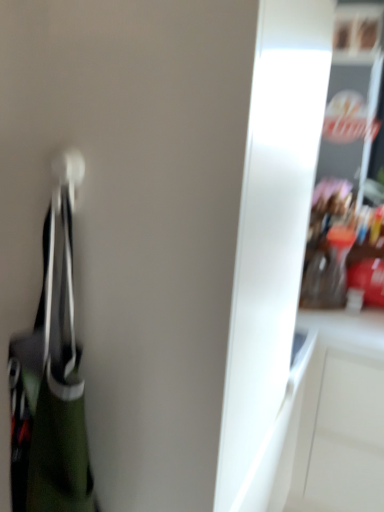
What do you see at coordinates (50, 394) in the screenshot?
I see `green fabric handbag at left` at bounding box center [50, 394].

Measure the distance between green fabric handbag at left and camera.

green fabric handbag at left is 65.99 centimeters from camera.

Locate an element on the screen. The image size is (384, 512). green fabric handbag at left is located at coordinates (50, 394).

Locate an element on the screen. The height and width of the screenshot is (512, 384). white glossy cabinet at right is located at coordinates (338, 418).

What do you see at coordinates (338, 418) in the screenshot? I see `white glossy cabinet at right` at bounding box center [338, 418].

Where is `green fabric handbag at left`? This screenshot has height=512, width=384. green fabric handbag at left is located at coordinates 50,394.

In the scene shown: Which is more to the left, white glossy cabinet at right or green fabric handbag at left?

green fabric handbag at left is more to the left.

Between white glossy cabinet at right and green fabric handbag at left, which one is positioned behind?

white glossy cabinet at right is further away from the camera.

Does point (381, 464) come farther from viewer compared to point (54, 341)?

Yes.

From the image's perspective, would you say white glossy cabinet at right is shown under green fabric handbag at left?

Correct, white glossy cabinet at right appears lower than green fabric handbag at left in the image.

From a real-world perspective, is white glossy cabinet at right beneath green fabric handbag at left?

Yes.

Which of these two, white glossy cabinet at right or green fabric handbag at left, is wider?

Wider between the two is white glossy cabinet at right.

Which of these two, white glossy cabinet at right or green fabric handbag at left, stands taller?

white glossy cabinet at right is taller.

Who is bigger, white glossy cabinet at right or green fabric handbag at left?

Bigger between the two is white glossy cabinet at right.

Is green fabric handbag at left a part of white glossy cabinet at right?

Definitely not — green fabric handbag at left is not inside white glossy cabinet at right.

Is white glossy cabinet at right touching green fabric handbag at left?

white glossy cabinet at right is not next to green fabric handbag at left, and they're not touching.

Is white glossy cabinet at right aimed at green fabric handbag at left?

Yes, white glossy cabinet at right is aimed at green fabric handbag at left.

What's the angular difference between white glossy cabinet at right and green fabric handbag at left's facing directions?

white glossy cabinet at right and green fabric handbag at left are facing 3.16 degrees away from each other.

Identify the location of cabinetry that appears behind the green fabric handbag at left. (338, 418).

Is green fabric handbag at left at the right side of white glossy cabinet at right?

No, green fabric handbag at left is not to the right of white glossy cabinet at right.

Does green fabric handbag at left come behind white glossy cabinet at right?

No, it is not.

Is point (42, 325) positioned behind point (327, 314)?

That is False.

From the image's perspective, does green fabric handbag at left appear higher than white glossy cabinet at right?

Indeed, from the image's perspective, green fabric handbag at left is shown above white glossy cabinet at right.

From a real-world perspective, between green fabric handbag at left and white glossy cabinet at right, who is vertically lower?

From a 3D spatial view, white glossy cabinet at right is below.

Which object is wider, green fabric handbag at left or white glossy cabinet at right?

Wider between the two is white glossy cabinet at right.

Considering the relative sizes of green fabric handbag at left and white glossy cabinet at right in the image provided, is green fabric handbag at left shorter than white glossy cabinet at right?

Indeed, green fabric handbag at left has a lesser height compared to white glossy cabinet at right.

Is green fabric handbag at left bigger or smaller than white glossy cabinet at right?

In the image, green fabric handbag at left appears to be smaller than white glossy cabinet at right.

Can we say green fabric handbag at left lies outside white glossy cabinet at right?

Yes, green fabric handbag at left is outside of white glossy cabinet at right.

Is green fabric handbag at left touching white glossy cabinet at right?

green fabric handbag at left is not next to white glossy cabinet at right, and they're not touching.

Is green fabric handbag at left oriented away from white glossy cabinet at right?

No, green fabric handbag at left is not facing the opposite direction of white glossy cabinet at right.

Measure the distance between green fabric handbag at left and white glossy cabinet at right.

A distance of 4.00 feet exists between green fabric handbag at left and white glossy cabinet at right.

In order to click on cabinetry lying behind the green fabric handbag at left in this screenshot , I will do `click(338, 418)`.

Find the location of a particular element. Image resolution: width=384 pixels, height=512 pixels. cabinetry located on the right of green fabric handbag at left is located at coordinates (338, 418).

Identify the location of handbag located on the left of white glossy cabinet at right. (50, 394).